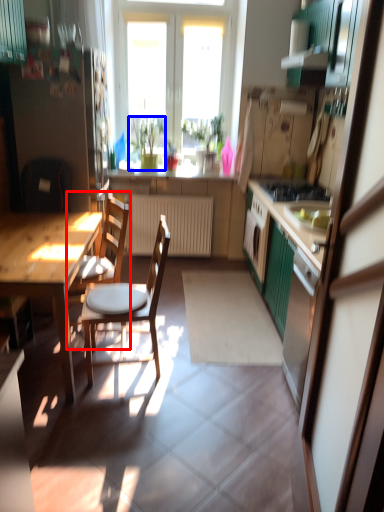
Question: Which point is closer to the camera, chair (highlighted by a red box) or houseplant (highlighted by a blue box)?

Choices:
 (A) chair
 (B) houseplant

Answer: (A)